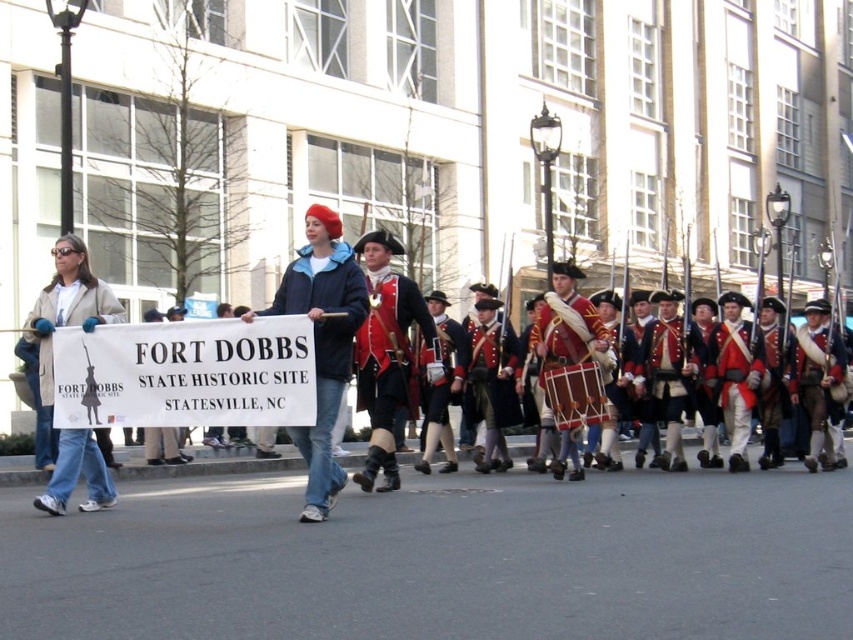
Question: Among these objects, which one is nearest to the camera?

Choices:
 (A) denim jacket at left
 (B) denim jacket at center
 (C) wooden drum at center
 (D) matte black jacket at center

Answer: (D)

Question: Considering the real-world distances, which object is farthest from the denim jacket at center?

Choices:
 (A) matte black jacket at center
 (B) wooden drum at center

Answer: (B)

Question: Is shiny red coat at center above denim jacket at left?

Choices:
 (A) no
 (B) yes

Answer: (A)

Question: In this image, where is shiny red coat at center located relative to wooden drum at center?

Choices:
 (A) below
 (B) above

Answer: (B)

Question: Can you confirm if shiny red coat at center is bigger than wooden drum at center?

Choices:
 (A) no
 (B) yes

Answer: (B)

Question: Among these points, which one is farthest from the camera?

Choices:
 (A) click(x=370, y=483)
 (B) click(x=350, y=342)

Answer: (A)